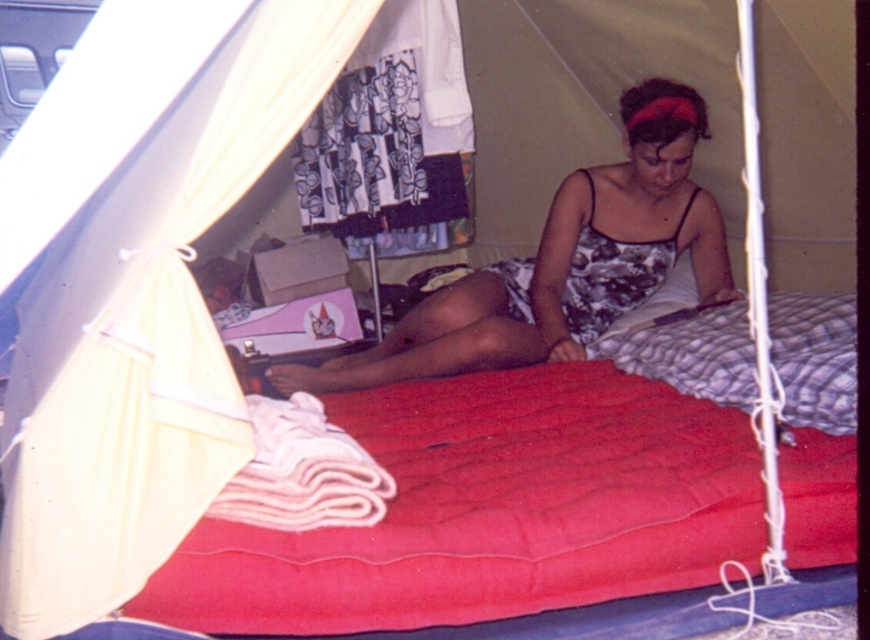
Between point (734, 429) and point (577, 182), which one is positioned in front?

Positioned in front is point (734, 429).

Which is behind, point (400, 563) or point (624, 257)?

Positioned behind is point (624, 257).

Based on the photo, who is more distant from viewer, (x=303, y=541) or (x=628, y=147)?

Positioned behind is point (x=628, y=147).

The width and height of the screenshot is (870, 640). I want to click on red quilted mattress at center, so click(492, 509).